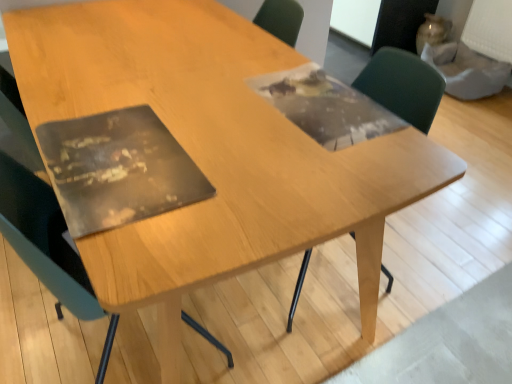
Identify the location of green plastic chair at upper right, the 1th chair viewed from the right. (402, 86).

Describe the element at coordinates (402, 86) in the screenshot. I see `green plastic chair at upper right, which is the 2th chair from left to right` at that location.

What is the approximate height of matte black chair at left, the first chair when ordered from left to right?

matte black chair at left, the first chair when ordered from left to right, is 84.50 centimeters in height.

Locate an element on the screen. This screenshot has width=512, height=384. matte black chair at left, the first chair when ordered from left to right is located at coordinates (42, 239).

Image resolution: width=512 pixels, height=384 pixels. Describe the element at coordinates (42, 239) in the screenshot. I see `matte black chair at left, the first chair when ordered from left to right` at that location.

Where is `green plastic chair at upper right, which is the 2th chair from left to right`? This screenshot has height=384, width=512. green plastic chair at upper right, which is the 2th chair from left to right is located at coordinates (402, 86).

Which is more to the right, matte black chair at left, the first chair when ordered from left to right, or green plastic chair at upper right, which is the 2th chair from left to right?

green plastic chair at upper right, which is the 2th chair from left to right, is more to the right.

Considering the relative positions of matte black chair at left, arranged as the 2th chair when viewed from the right, and green plastic chair at upper right, the 1th chair viewed from the right, in the image provided, is matte black chair at left, arranged as the 2th chair when viewed from the right, behind green plastic chair at upper right, the 1th chair viewed from the right,?

That is False.

Which is behind, point (32, 262) or point (408, 85)?

The point (408, 85) is farther.

From the image's perspective, is matte black chair at left, arranged as the 2th chair when viewed from the right, on green plastic chair at upper right, the 1th chair viewed from the right?

No.

In the scene shown: From a real-world perspective, is matte black chair at left, the first chair when ordered from left to right, physically located above or below green plastic chair at upper right, the 1th chair viewed from the right?

matte black chair at left, the first chair when ordered from left to right, is situated lower than green plastic chair at upper right, the 1th chair viewed from the right, in the real world.

In terms of width, does matte black chair at left, the first chair when ordered from left to right, look wider or thinner when compared to green plastic chair at upper right, the 1th chair viewed from the right?

Clearly, matte black chair at left, the first chair when ordered from left to right, has more width compared to green plastic chair at upper right, the 1th chair viewed from the right.

Can you confirm if matte black chair at left, arranged as the 2th chair when viewed from the right, is shorter than green plastic chair at upper right, which is the 2th chair from left to right?

No, matte black chair at left, arranged as the 2th chair when viewed from the right, is not shorter than green plastic chair at upper right, which is the 2th chair from left to right.

Looking at this image, based on their sizes in the image, would you say matte black chair at left, the first chair when ordered from left to right, is bigger or smaller than green plastic chair at upper right, which is the 2th chair from left to right?

Clearly, matte black chair at left, the first chair when ordered from left to right, is larger in size than green plastic chair at upper right, which is the 2th chair from left to right.

Is matte black chair at left, the first chair when ordered from left to right, not inside green plastic chair at upper right, which is the 2th chair from left to right?

Yes, matte black chair at left, the first chair when ordered from left to right, is located beyond the bounds of green plastic chair at upper right, which is the 2th chair from left to right.

Would you consider matte black chair at left, the first chair when ordered from left to right, to be distant from green plastic chair at upper right, which is the 2th chair from left to right?

Yes, matte black chair at left, the first chair when ordered from left to right, and green plastic chair at upper right, which is the 2th chair from left to right, are located far from each other.

Is matte black chair at left, the first chair when ordered from left to right, facing away from green plastic chair at upper right, which is the 2th chair from left to right?

That's not correct — matte black chair at left, the first chair when ordered from left to right, is not looking away from green plastic chair at upper right, which is the 2th chair from left to right.

From the picture: What's the angular difference between matte black chair at left, arranged as the 2th chair when viewed from the right, and green plastic chair at upper right, which is the 2th chair from left to right,'s facing directions?

The angular difference between matte black chair at left, arranged as the 2th chair when viewed from the right, and green plastic chair at upper right, which is the 2th chair from left to right, is 175 degrees.

You are a GUI agent. You are given a task and a screenshot of the screen. Output one action in this format:
    pyautogui.click(x=<x>, y=<y>)
    Task: Click on the chair lying on the left of green plastic chair at upper right, which is the 2th chair from left to right
    Image resolution: width=512 pixels, height=384 pixels.
    Given the screenshot: What is the action you would take?
    pyautogui.click(x=42, y=239)

Based on the photo, does green plastic chair at upper right, the 1th chair viewed from the right, appear on the right side of matte black chair at left, the first chair when ordered from left to right?

Yes.

Which object is closer to the camera taking this photo, green plastic chair at upper right, which is the 2th chair from left to right, or matte black chair at left, arranged as the 2th chair when viewed from the right?

matte black chair at left, arranged as the 2th chair when viewed from the right, is more forward.

Between point (436, 103) and point (96, 377), which one is positioned behind?

The point (96, 377) is more distant.

From the image's perspective, is green plastic chair at upper right, the 1th chair viewed from the right, above matte black chair at left, arranged as the 2th chair when viewed from the right?

Indeed, from the image's perspective, green plastic chair at upper right, the 1th chair viewed from the right, is shown above matte black chair at left, arranged as the 2th chair when viewed from the right.

From a real-world perspective, is green plastic chair at upper right, which is the 2th chair from left to right, beneath matte black chair at left, the first chair when ordered from left to right?

No, from a real-world perspective, green plastic chair at upper right, which is the 2th chair from left to right, is not beneath matte black chair at left, the first chair when ordered from left to right.

Does green plastic chair at upper right, which is the 2th chair from left to right, have a greater width compared to matte black chair at left, the first chair when ordered from left to right?

No.

Between green plastic chair at upper right, which is the 2th chair from left to right, and matte black chair at left, arranged as the 2th chair when viewed from the right, which one has less height?

Standing shorter between the two is green plastic chair at upper right, which is the 2th chair from left to right.

Which of these two, green plastic chair at upper right, the 1th chair viewed from the right, or matte black chair at left, the first chair when ordered from left to right, is bigger?

Bigger between the two is matte black chair at left, the first chair when ordered from left to right.

Is green plastic chair at upper right, the 1th chair viewed from the right, positioned beyond the bounds of matte black chair at left, the first chair when ordered from left to right?

Yes, green plastic chair at upper right, the 1th chair viewed from the right, is outside of matte black chair at left, the first chair when ordered from left to right.

Are green plastic chair at upper right, the 1th chair viewed from the right, and matte black chair at left, the first chair when ordered from left to right, beside each other?

green plastic chair at upper right, the 1th chair viewed from the right, and matte black chair at left, the first chair when ordered from left to right, are not in contact.

From the picture: Does green plastic chair at upper right, which is the 2th chair from left to right, turn towards matte black chair at left, arranged as the 2th chair when viewed from the right?

Yes, green plastic chair at upper right, which is the 2th chair from left to right, faces towards matte black chair at left, arranged as the 2th chair when viewed from the right.

How many degrees apart are the facing directions of green plastic chair at upper right, the 1th chair viewed from the right, and matte black chair at left, arranged as the 2th chair when viewed from the right?

The facing directions of green plastic chair at upper right, the 1th chair viewed from the right, and matte black chair at left, arranged as the 2th chair when viewed from the right, are 175 degrees apart.

Where is `chair below the green plastic chair at upper right, the 1th chair viewed from the right (from the image's perspective)`? This screenshot has height=384, width=512. chair below the green plastic chair at upper right, the 1th chair viewed from the right (from the image's perspective) is located at coordinates (42, 239).

Identify the location of chair that appears in front of the green plastic chair at upper right, the 1th chair viewed from the right. (42, 239).

Where is `chair lying on the right of matte black chair at left, the first chair when ordered from left to right`? chair lying on the right of matte black chair at left, the first chair when ordered from left to right is located at coordinates (402, 86).